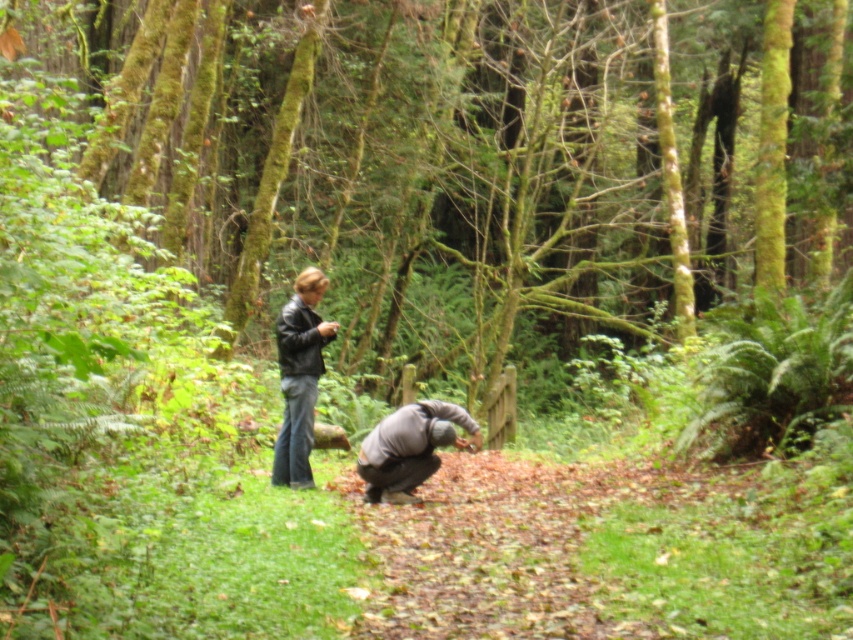
Question: Does matte black jacket at center have a lesser width compared to gray matte jacket at lower center?

Choices:
 (A) no
 (B) yes

Answer: (B)

Question: Is matte black jacket at center bigger than gray matte jacket at lower center?

Choices:
 (A) yes
 (B) no

Answer: (A)

Question: Considering the relative positions of matte black jacket at center and gray matte jacket at lower center in the image provided, where is matte black jacket at center located with respect to gray matte jacket at lower center?

Choices:
 (A) below
 (B) above

Answer: (B)

Question: Which point is farther from the camera taking this photo?

Choices:
 (A) (299, 472)
 (B) (399, 406)

Answer: (B)